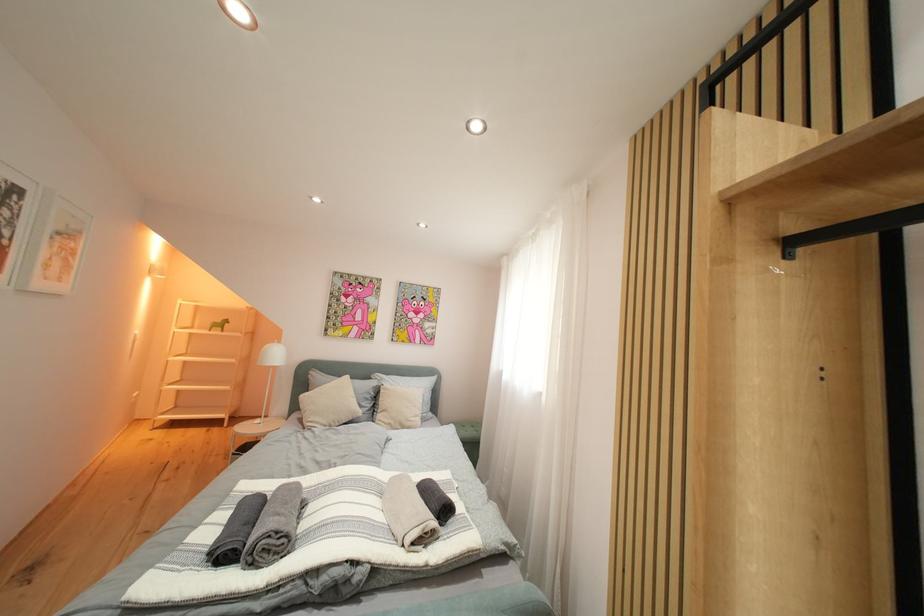
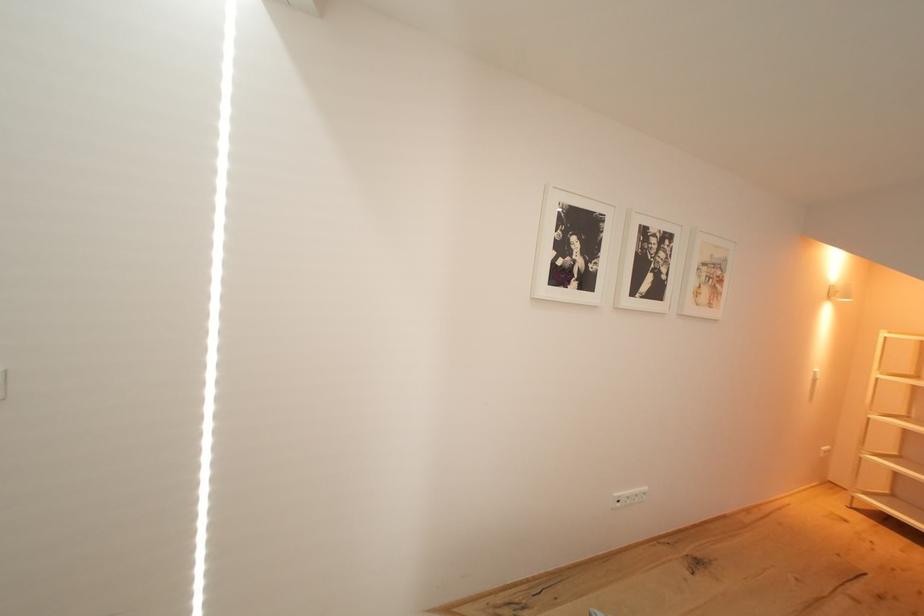
Question: The camera is either moving clockwise (left) or counter-clockwise (right) around the object. The first image is from the beginning of the video and the second image is from the end. Is the camera moving left or right when shooting the video?

Choices:
 (A) Left
 (B) Right

Answer: (B)